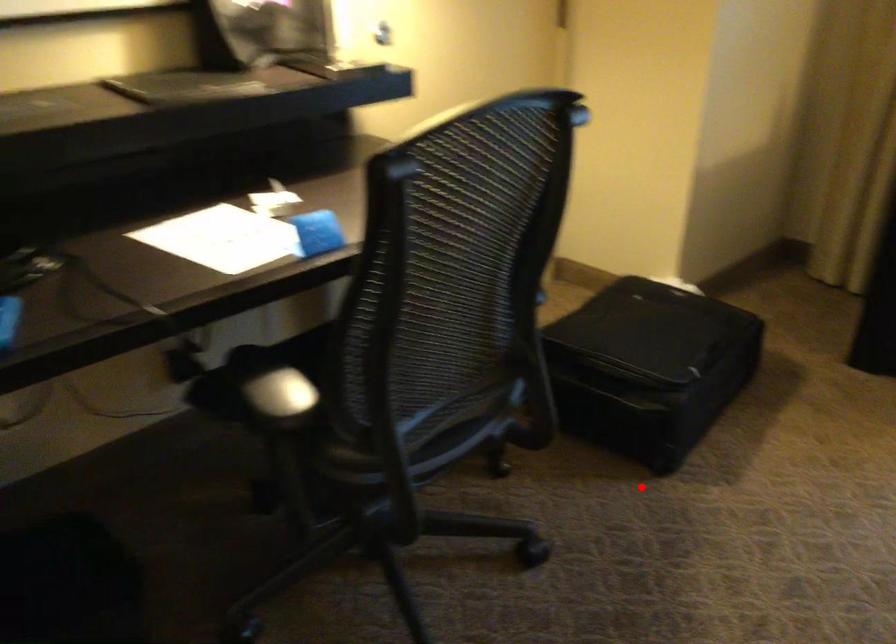
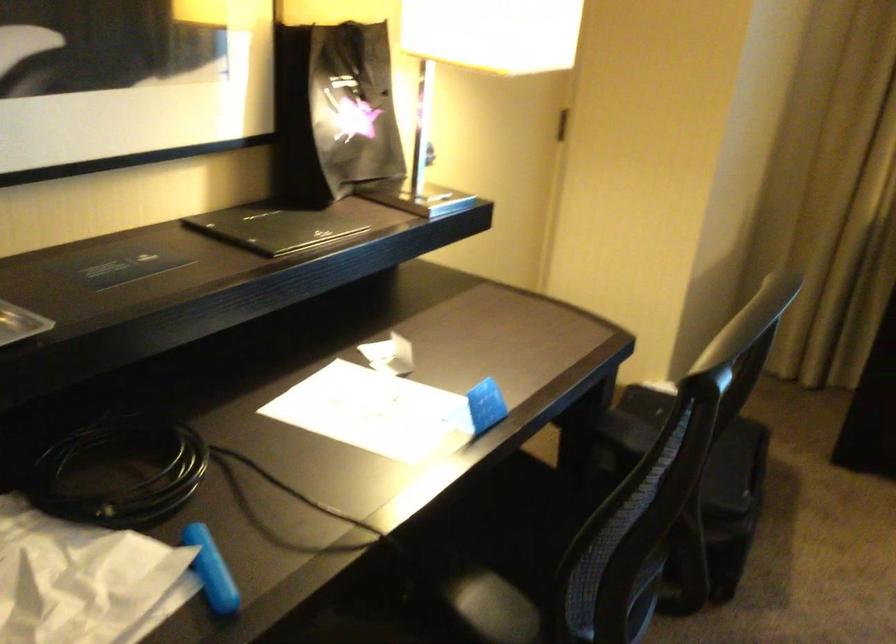
Locate, in the second image, the point that corresponds to the highlighted location in the first image.

(709, 618)